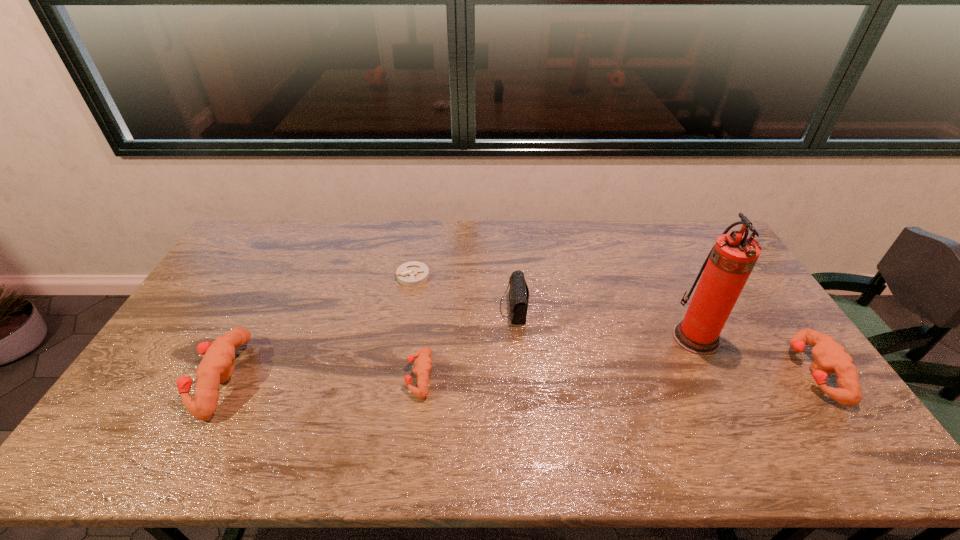
The width and height of the screenshot is (960, 540). In the image, there is a desktop. Find the location of `vacant space at the left edge`. vacant space at the left edge is located at coordinates (236, 313).

Locate an element on the screen. The height and width of the screenshot is (540, 960). free space at the far right corner of the desktop is located at coordinates (668, 221).

This screenshot has width=960, height=540. I want to click on empty space that is in between the ashtray and the leftmost object, so click(317, 327).

What are the coordinates of `free space between the second puncher from left to right and the leftmost object` in the screenshot? It's located at (321, 377).

Locate an element on the screen. This screenshot has height=540, width=960. free space between the rightmost puncher and the tallest object is located at coordinates pyautogui.click(x=755, y=355).

This screenshot has width=960, height=540. What are the coordinates of `empty location between the shortest puncher and the second shortest puncher` in the screenshot? It's located at tap(617, 374).

I want to click on vacant space that is in between the farthest object and the second shortest puncher, so click(x=613, y=324).

You are a GUI agent. You are given a task and a screenshot of the screen. Output one action in this format:
    pyautogui.click(x=<x>, y=<y>)
    Task: Click on the vacant area between the clutch bag and the leftmost object
    
    Given the screenshot: What is the action you would take?
    pyautogui.click(x=367, y=343)

Find the location of `vacant space in between the clutch bag and the rightmost puncher`. vacant space in between the clutch bag and the rightmost puncher is located at coordinates (663, 340).

What are the coordinates of `vacant area between the fourth object from left to right and the fire extinguisher` in the screenshot? It's located at (605, 323).